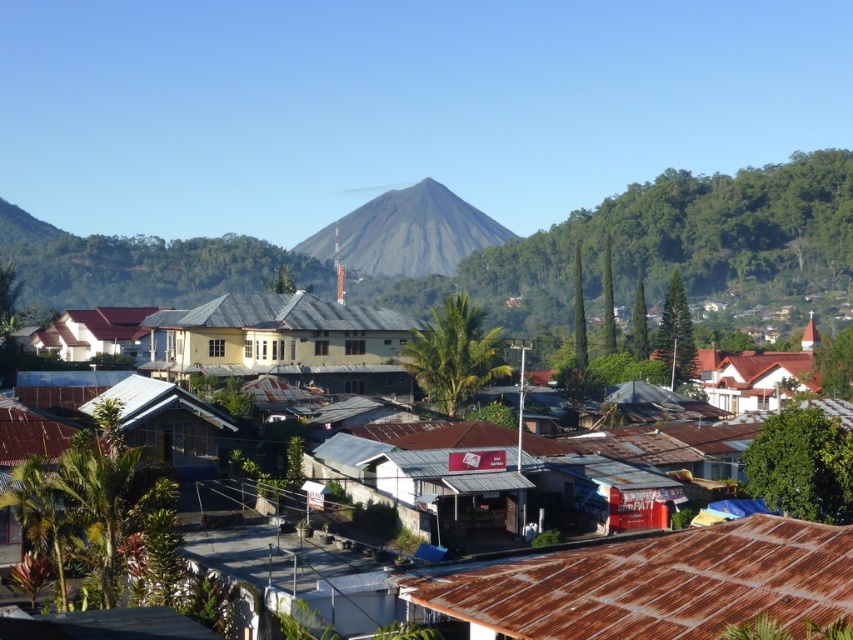
Question: Which object is the farthest from the gray matte mountain at center?

Choices:
 (A) rusty corrugated roof at lower right
 (B) rusty metal roofs at center
 (C) brown corrugated metal hut at lower left

Answer: (A)

Question: Which point is farther from the camera taking this photo?

Choices:
 (A) pos(457,428)
 (B) pos(325,259)
 (C) pos(788,576)

Answer: (B)

Question: Can you confirm if rusty metal roofs at center is positioned below brown corrugated metal hut at lower left?

Choices:
 (A) yes
 (B) no

Answer: (B)

Question: Is rusty corrugated roof at lower right wider than brown corrugated metal hut at lower left?

Choices:
 (A) yes
 (B) no

Answer: (B)

Question: Estimate the real-world distances between objects in this image. Which object is closer to the rusty corrugated roof at lower right?

Choices:
 (A) brown corrugated metal hut at lower left
 (B) rusty metal roofs at center
 (C) gray matte mountain at center

Answer: (B)

Question: Can you confirm if rusty corrugated roof at lower right is thinner than brown corrugated metal hut at lower left?

Choices:
 (A) yes
 (B) no

Answer: (A)